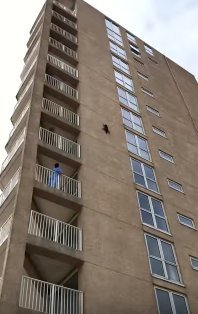
Locate an element on the screen. This screenshot has width=198, height=314. small windows is located at coordinates (x=163, y=154).